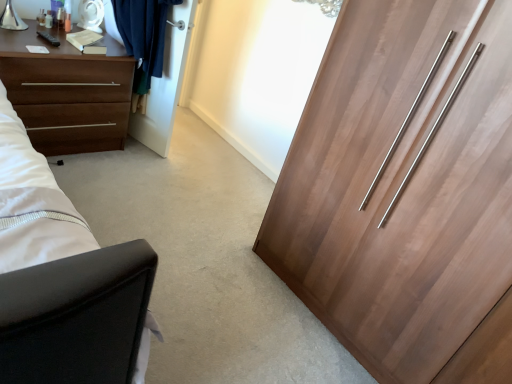
Question: From a real-world perspective, is white glossy door at upper center under wooden wardrobe at right?

Choices:
 (A) no
 (B) yes

Answer: (B)

Question: Considering the relative positions of white glossy door at upper center and wooden wardrobe at right in the image provided, is white glossy door at upper center in front of wooden wardrobe at right?

Choices:
 (A) no
 (B) yes

Answer: (A)

Question: From a real-world perspective, is white glossy door at upper center located higher than wooden wardrobe at right?

Choices:
 (A) no
 (B) yes

Answer: (A)

Question: From the image's perspective, would you say white glossy door at upper center is shown under wooden wardrobe at right?

Choices:
 (A) no
 (B) yes

Answer: (A)

Question: Can you see white glossy door at upper center touching wooden wardrobe at right?

Choices:
 (A) yes
 (B) no

Answer: (B)

Question: Can you confirm if white glossy door at upper center is smaller than wooden wardrobe at right?

Choices:
 (A) yes
 (B) no

Answer: (A)

Question: Does wooden wardrobe at right have a greater width compared to brown matte chest of drawers at left?

Choices:
 (A) no
 (B) yes

Answer: (B)

Question: Is wooden wardrobe at right thinner than brown matte chest of drawers at left?

Choices:
 (A) no
 (B) yes

Answer: (A)

Question: Considering the relative sizes of wooden wardrobe at right and brown matte chest of drawers at left in the image provided, is wooden wardrobe at right smaller than brown matte chest of drawers at left?

Choices:
 (A) yes
 (B) no

Answer: (B)

Question: Is wooden wardrobe at right with brown matte chest of drawers at left?

Choices:
 (A) yes
 (B) no

Answer: (B)

Question: From the image's perspective, would you say wooden wardrobe at right is shown under brown matte chest of drawers at left?

Choices:
 (A) yes
 (B) no

Answer: (A)

Question: Does wooden wardrobe at right have a larger size compared to brown matte chest of drawers at left?

Choices:
 (A) yes
 (B) no

Answer: (A)

Question: Is wooden wardrobe at right closer to the viewer compared to white glossy door at upper center?

Choices:
 (A) yes
 (B) no

Answer: (A)